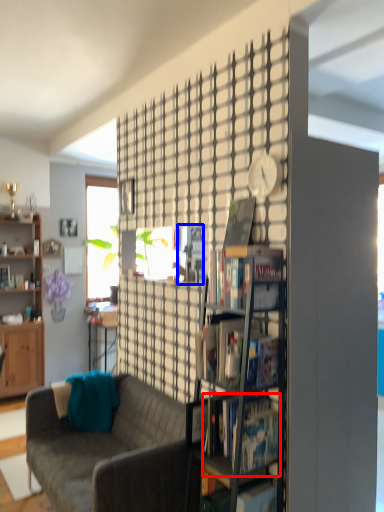
Question: Among these objects, which one is farthest to the camera, book (highlighted by a red box) or magazine (highlighted by a blue box)?

Choices:
 (A) book
 (B) magazine

Answer: (B)